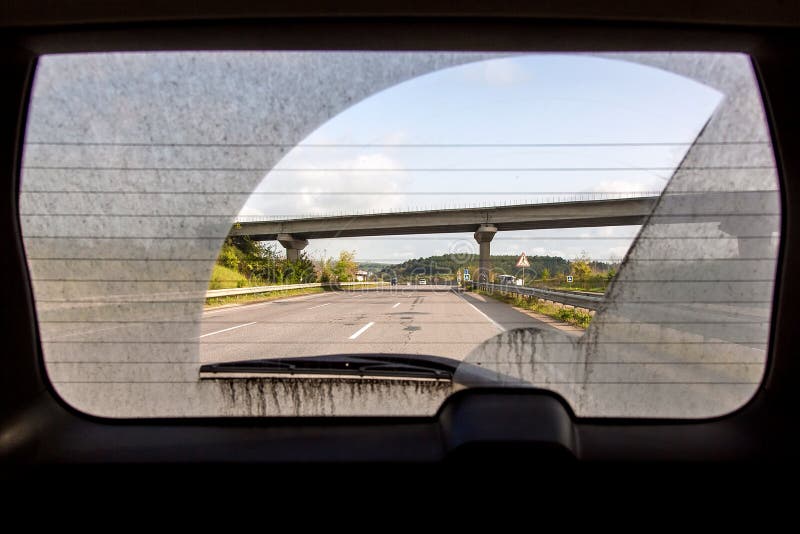
This screenshot has height=534, width=800. Identify the location of dust. (313, 389).